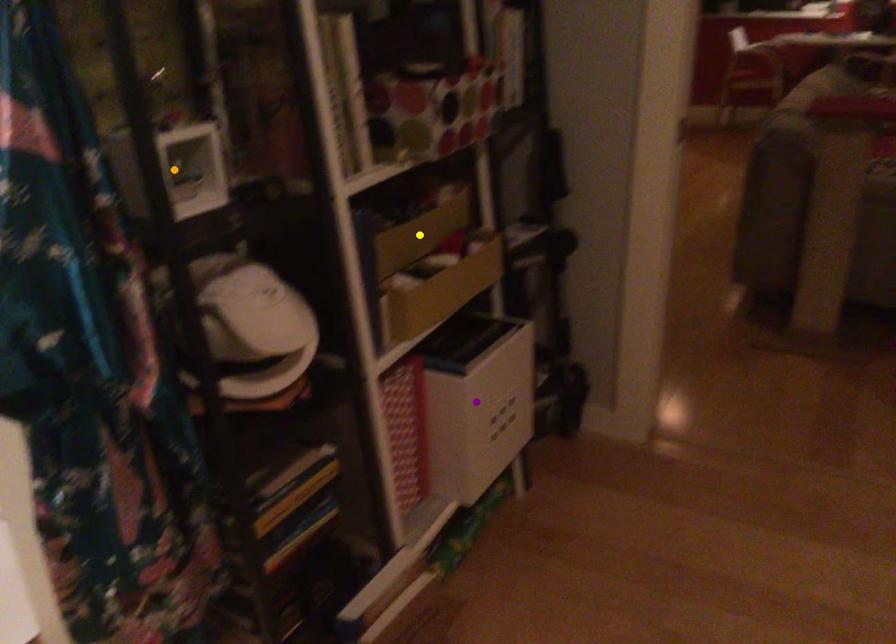
Order these from nearest to farthest:
purple point, orange point, yellow point

orange point
purple point
yellow point